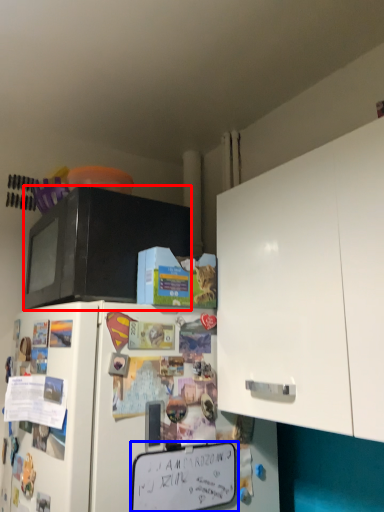
Question: Which object is further to the camera taking this photo, microwave oven (highlighted by a red box) or bulletin board (highlighted by a blue box)?

Choices:
 (A) microwave oven
 (B) bulletin board

Answer: (A)